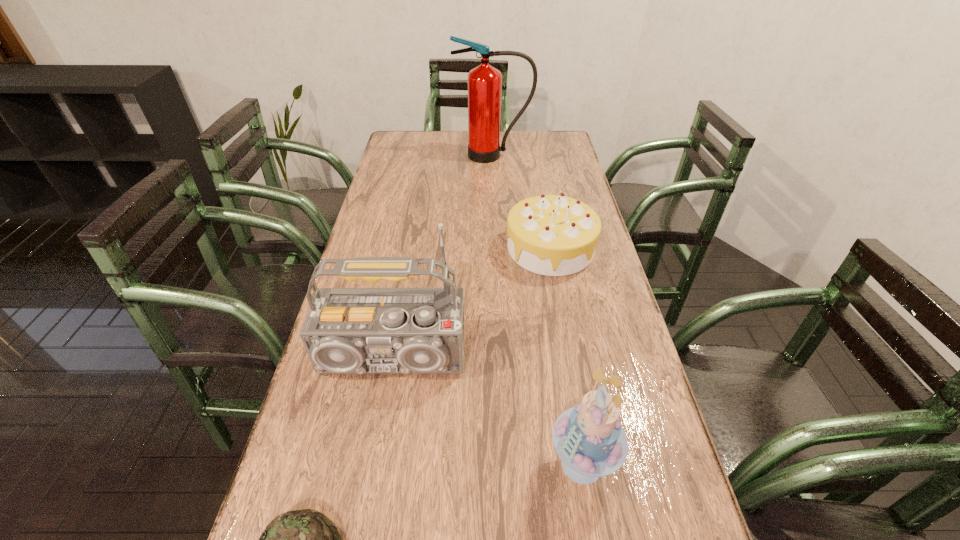
The width and height of the screenshot is (960, 540). In order to click on free region located with a ladder on the side of the third shortest object in this screenshot , I will do `click(425, 464)`.

At what (x,y) coordinates should I click in order to perform the action: click on vacant space situated 0.060m with a ladder on the side of the third shortest object. Please return your answer as a coordinate pair (x, y). Looking at the image, I should click on (516, 464).

This screenshot has width=960, height=540. I want to click on blank area located with a ladder on the side of the third shortest object, so click(476, 464).

Locate an element on the screen. The height and width of the screenshot is (540, 960). free space located 0.210m on the front of the fourth nearest object is located at coordinates (566, 336).

Where is `object located in the far edge section of the desktop`? The width and height of the screenshot is (960, 540). object located in the far edge section of the desktop is located at coordinates (484, 82).

Where is `object situated at the left edge`? The image size is (960, 540). object situated at the left edge is located at coordinates (347, 330).

Locate an element on the screen. This screenshot has height=540, width=960. cake that is at the right edge is located at coordinates (589, 438).

At what (x,y) coordinates should I click in order to perform the action: click on birthday cake located at the right edge. Please return your answer as a coordinate pair (x, y). The width and height of the screenshot is (960, 540). Looking at the image, I should click on (554, 235).

You are a GUI agent. You are given a task and a screenshot of the screen. Output one action in this format:
    pyautogui.click(x=<x>, y=<y>)
    Task: Click on the free space at the far edge of the desktop
    This screenshot has width=960, height=540.
    Given the screenshot: What is the action you would take?
    pyautogui.click(x=443, y=157)

I want to click on vacant space at the left edge of the desktop, so click(x=381, y=380).